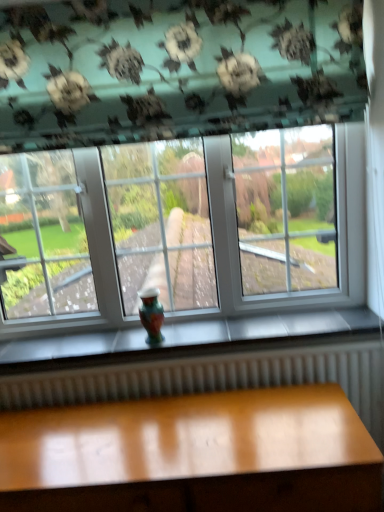
Question: Can you confirm if multicolored glass vase at center is smaller than glossy wood table at lower center?

Choices:
 (A) yes
 (B) no

Answer: (A)

Question: Considering the relative sizes of multicolored glass vase at center and glossy wood table at lower center in the image provided, is multicolored glass vase at center shorter than glossy wood table at lower center?

Choices:
 (A) yes
 (B) no

Answer: (A)

Question: Is multicolored glass vase at center closer to camera compared to glossy wood table at lower center?

Choices:
 (A) yes
 (B) no

Answer: (B)

Question: Can you confirm if multicolored glass vase at center is bigger than glossy wood table at lower center?

Choices:
 (A) no
 (B) yes

Answer: (A)

Question: Considering the relative sizes of multicolored glass vase at center and glossy wood table at lower center in the image provided, is multicolored glass vase at center wider than glossy wood table at lower center?

Choices:
 (A) yes
 (B) no

Answer: (B)

Question: Does multicolored glass vase at center appear on the left side of glossy wood table at lower center?

Choices:
 (A) yes
 (B) no

Answer: (A)

Question: Does glossy wood table at lower center have a lesser width compared to multicolored glass vase at center?

Choices:
 (A) yes
 (B) no

Answer: (B)

Question: Are glossy wood table at lower center and multicolored glass vase at center located far from each other?

Choices:
 (A) no
 (B) yes

Answer: (A)

Question: From a real-world perspective, is glossy wood table at lower center located beneath multicolored glass vase at center?

Choices:
 (A) no
 (B) yes

Answer: (B)

Question: Is glossy wood table at lower center bigger than multicolored glass vase at center?

Choices:
 (A) yes
 (B) no

Answer: (A)

Question: Is glossy wood table at lower center positioned with its back to multicolored glass vase at center?

Choices:
 (A) yes
 (B) no

Answer: (B)

Question: From a real-world perspective, is glossy wood table at lower center positioned over multicolored glass vase at center based on gravity?

Choices:
 (A) no
 (B) yes

Answer: (A)

Question: Does point (332, 395) appear closer or farther from the camera than point (157, 332)?

Choices:
 (A) closer
 (B) farther

Answer: (A)